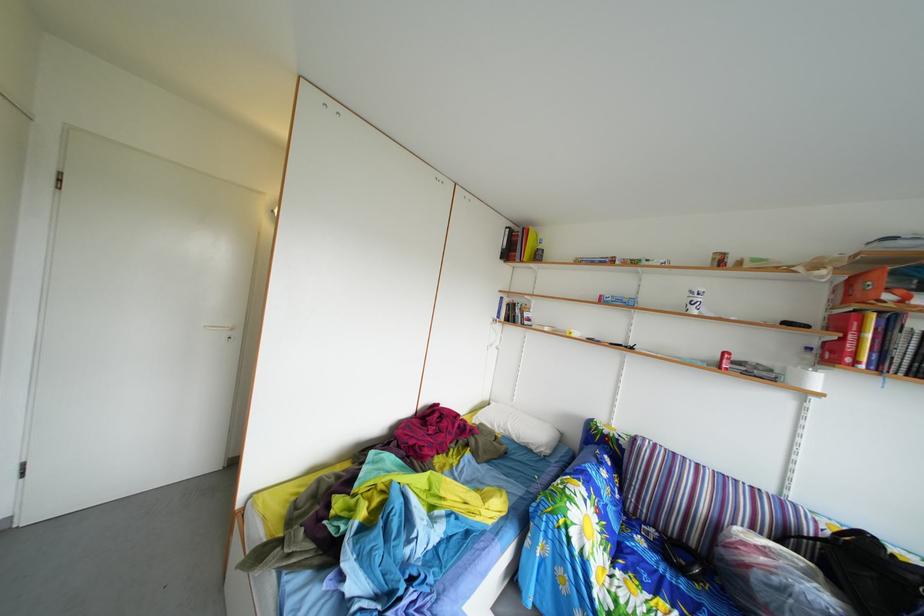
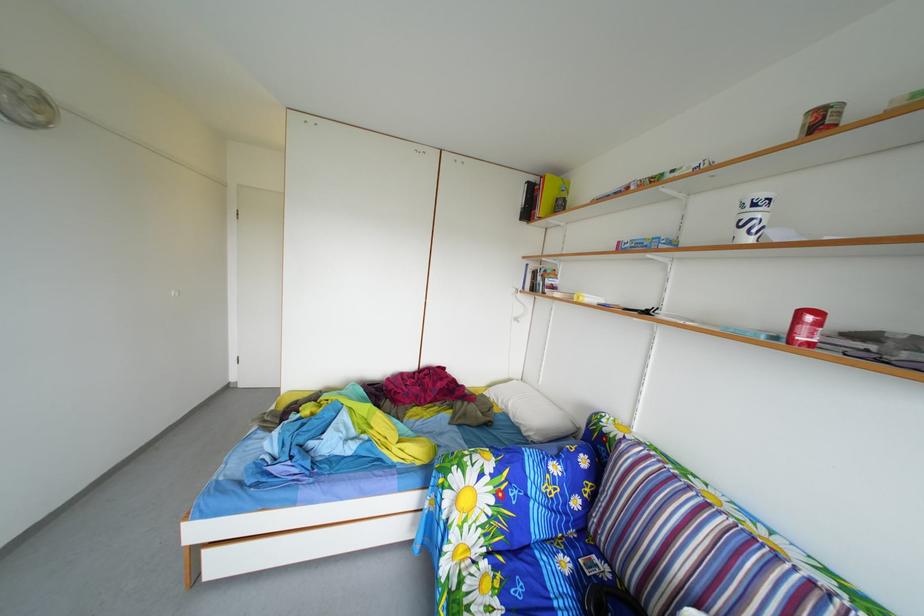
The point at (579,546) is marked in the first image. Where is the corresponding point in the second image?

(453, 507)